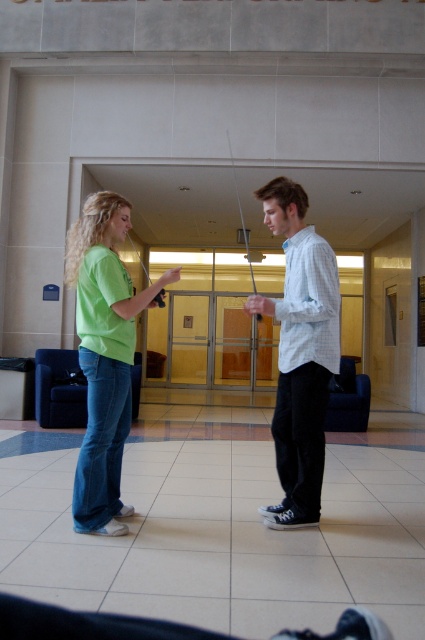
Question: Considering the relative positions of matte green t-shirt at center and light blue checkered shirt at center in the image provided, where is matte green t-shirt at center located with respect to light blue checkered shirt at center?

Choices:
 (A) below
 (B) above

Answer: (B)

Question: Observing the image, what is the correct spatial positioning of light blue checkered shirt at center in reference to green matte shirt at left?

Choices:
 (A) below
 (B) above

Answer: (B)

Question: Which is farther from the green matte shirt at left?

Choices:
 (A) matte green t-shirt at center
 (B) light blue checkered shirt at center

Answer: (A)

Question: Which is nearer to the matte green t-shirt at center?

Choices:
 (A) light blue checkered shirt at center
 (B) green matte shirt at left

Answer: (A)

Question: Which point is farther to the camera?

Choices:
 (A) light blue checkered shirt at center
 (B) green matte shirt at left
 (C) matte green t-shirt at center

Answer: (B)

Question: Is matte green t-shirt at center further to the viewer compared to light blue checkered shirt at center?

Choices:
 (A) yes
 (B) no

Answer: (B)